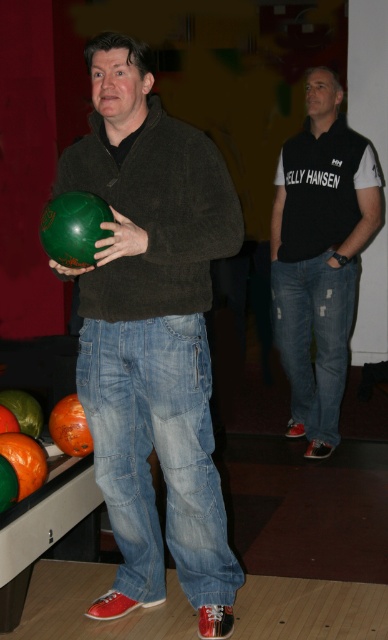
Does matte green bowling ball at left have a lesser width compared to ripped denim jeans at center?

No, matte green bowling ball at left is not thinner than ripped denim jeans at center.

Who is shorter, matte green bowling ball at left or ripped denim jeans at center?

ripped denim jeans at center

Who is more distant from viewer, (122, 228) or (325, 356)?

The point (325, 356) is behind.

The width and height of the screenshot is (388, 640). I want to click on matte green bowling ball at left, so click(x=152, y=333).

Can you confirm if light blue denim jeans at center is positioned to the left of green matte bowling ball at center?

Incorrect, light blue denim jeans at center is not on the left side of green matte bowling ball at center.

Does light blue denim jeans at center have a greater width compared to green matte bowling ball at center?

Yes.

Locate an element on the screen. This screenshot has height=640, width=388. light blue denim jeans at center is located at coordinates (157, 452).

Who is positioned more to the left, black jersey at center or green matte bowling ball at center?

green matte bowling ball at center is more to the left.

Can you confirm if black jersey at center is shorter than green matte bowling ball at center?

In fact, black jersey at center may be taller than green matte bowling ball at center.

This screenshot has height=640, width=388. What do you see at coordinates (320, 256) in the screenshot?
I see `black jersey at center` at bounding box center [320, 256].

Where is `black jersey at center`? The height and width of the screenshot is (640, 388). black jersey at center is located at coordinates (320, 256).